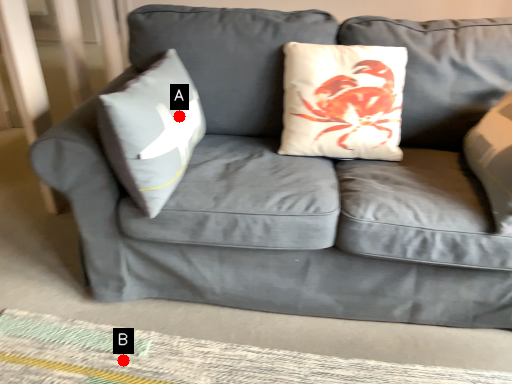
Question: Two points are circled on the image, labeled by A and B beside each circle. Which point is farther from the camera taking this photo?

Choices:
 (A) A is further
 (B) B is further

Answer: (A)